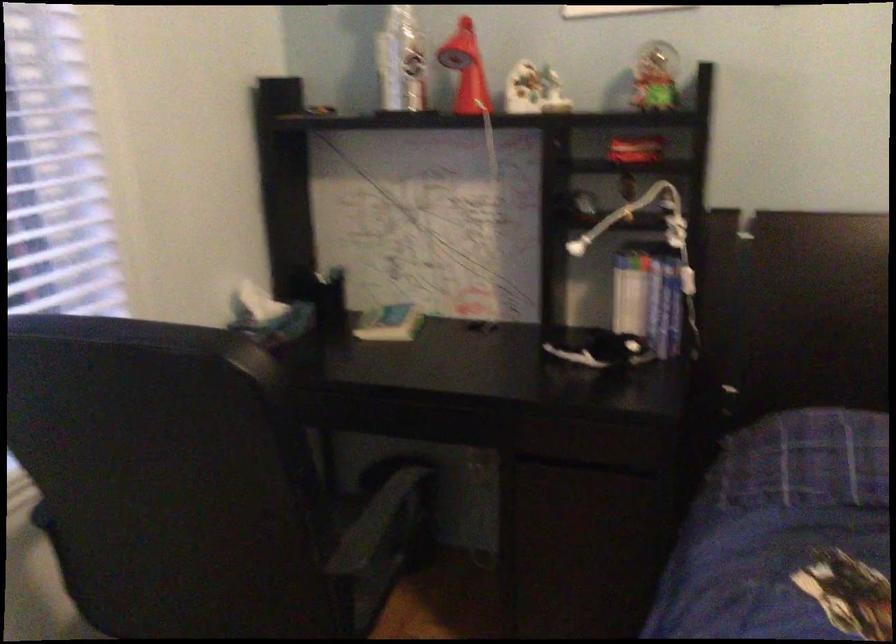
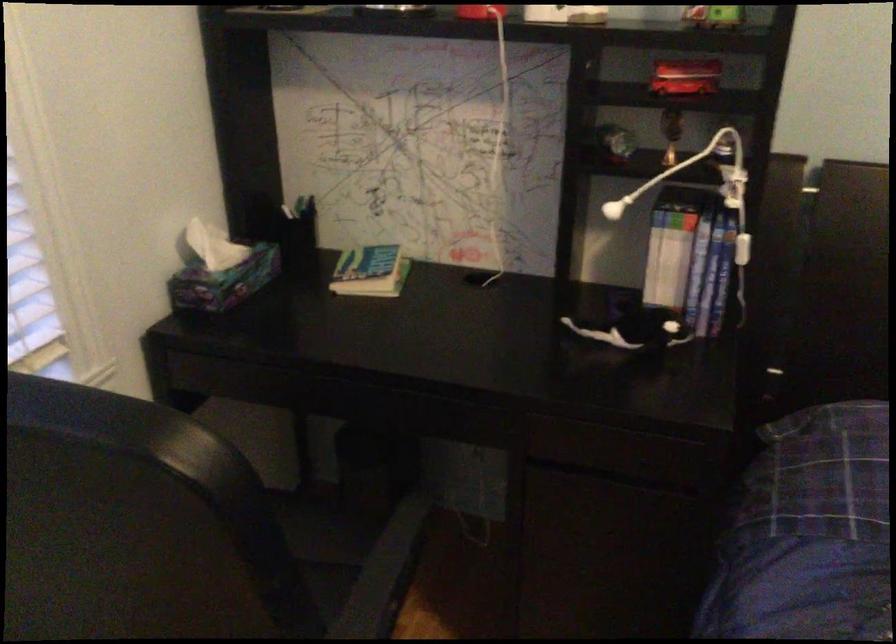
The point at (325, 275) is marked in the first image. Where is the corresponding point in the second image?

(295, 211)